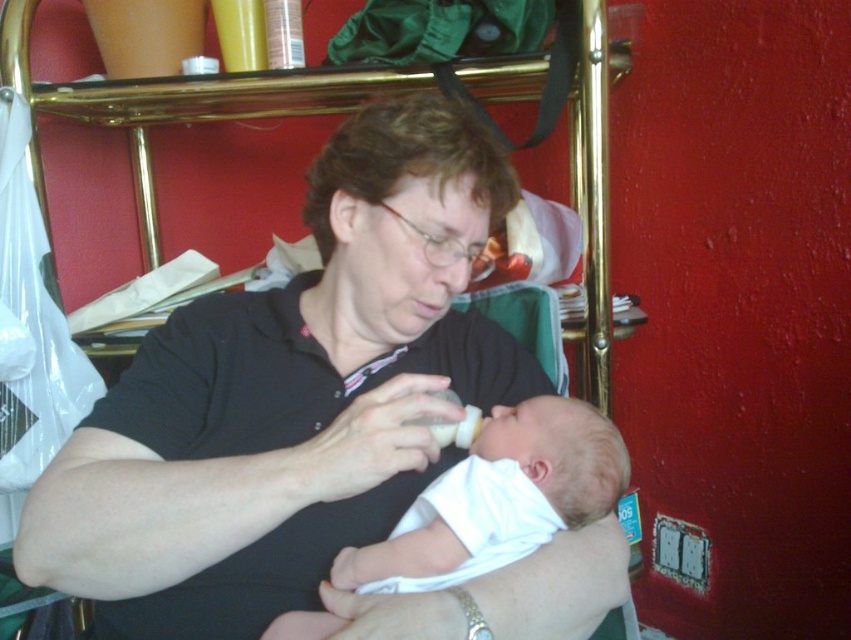
Question: Which of these objects is positioned farthest from the white matte baby at center?

Choices:
 (A) white matte baby bottle at center
 (B) black matte shirt at center

Answer: (B)

Question: Which of these objects is positioned closest to the black matte shirt at center?

Choices:
 (A) white matte baby bottle at center
 (B) white matte baby at center

Answer: (B)

Question: Which is nearer to the black matte shirt at center?

Choices:
 (A) white matte baby at center
 (B) white matte baby bottle at center

Answer: (A)

Question: Is black matte shirt at center to the left of white matte baby at center from the viewer's perspective?

Choices:
 (A) no
 (B) yes

Answer: (B)

Question: Can you confirm if white matte baby at center is smaller than white matte baby bottle at center?

Choices:
 (A) yes
 (B) no

Answer: (B)

Question: Can you confirm if black matte shirt at center is positioned below white matte baby bottle at center?

Choices:
 (A) yes
 (B) no

Answer: (B)